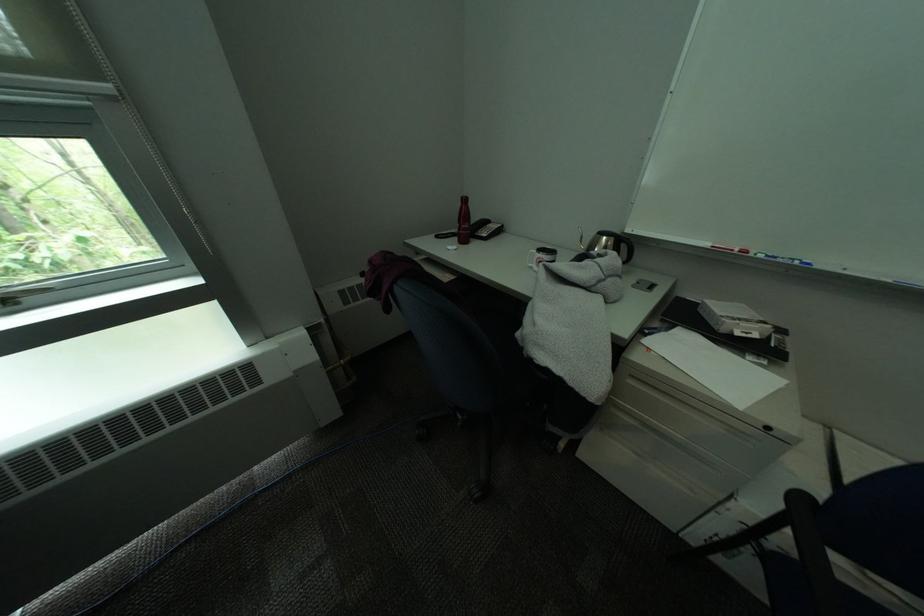
Where would you lift the telephone handset? Please return your answer as a coordinate pair (x, y).

(484, 229)